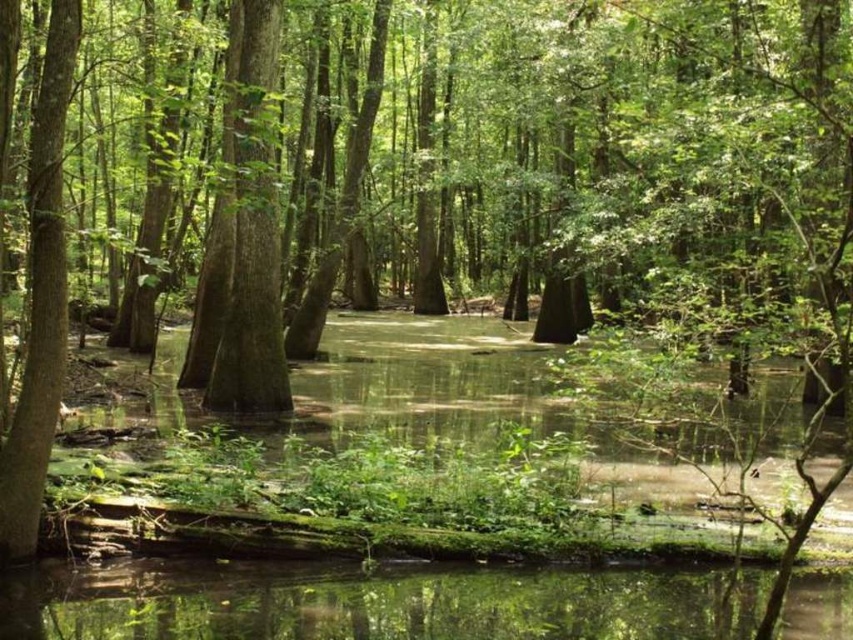
Question: Which of the following is the closest to the observer?

Choices:
 (A) green reflective water at center
 (B) green rough bark tree at center

Answer: (A)

Question: Is green reflective water at center further to the viewer compared to green rough bark tree at center?

Choices:
 (A) no
 (B) yes

Answer: (A)

Question: Is green reflective water at center above green rough bark tree at center?

Choices:
 (A) yes
 (B) no

Answer: (B)

Question: Which point is farther from the camera taking this photo?

Choices:
 (A) [x=142, y=621]
 (B) [x=251, y=230]

Answer: (B)

Question: Can you confirm if green reflective water at center is smaller than green rough bark tree at center?

Choices:
 (A) no
 (B) yes

Answer: (B)